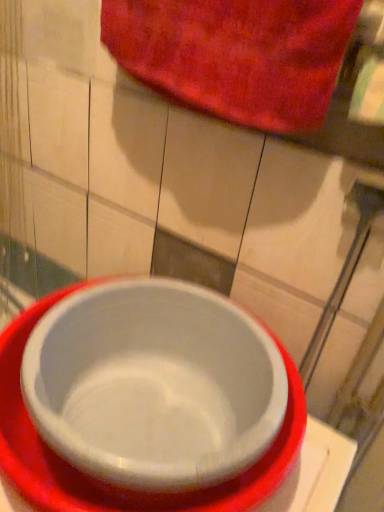
This screenshot has width=384, height=512. What do you see at coordinates (236, 55) in the screenshot?
I see `velvety red towel at upper center` at bounding box center [236, 55].

Find the location of `velvety red towel at upper center`. velvety red towel at upper center is located at coordinates (236, 55).

The width and height of the screenshot is (384, 512). Describe the element at coordinates (154, 385) in the screenshot. I see `white plastic bowl at center` at that location.

Identify the location of white plastic bowl at center. The image size is (384, 512). (154, 385).

Measure the distance between white plastic bowl at center and camera.

white plastic bowl at center is 17.48 inches from camera.

At what (x,y) coordinates should I click in order to perform the action: click on velvety red towel at upper center. Please return your answer as a coordinate pair (x, y). Looking at the image, I should click on (236, 55).

Considering the relative positions of velvety red towel at upper center and white plastic bowl at center in the image provided, is velvety red towel at upper center to the left of white plastic bowl at center from the viewer's perspective?

No.

Does velvety red towel at upper center lie in front of white plastic bowl at center?

No, the depth of velvety red towel at upper center is greater than that of white plastic bowl at center.

Considering the points (273, 23) and (101, 314), which point is in front, point (273, 23) or point (101, 314)?

The point (273, 23) is more forward.

From the image's perspective, which one is positioned lower, velvety red towel at upper center or white plastic bowl at center?

white plastic bowl at center, from the image's perspective.

From a real-world perspective, is velvety red towel at upper center above or below white plastic bowl at center?

Clearly, from a real-world perspective, velvety red towel at upper center is above white plastic bowl at center.

Between velvety red towel at upper center and white plastic bowl at center, which one has smaller width?

velvety red towel at upper center.

Considering the relative sizes of velvety red towel at upper center and white plastic bowl at center in the image provided, is velvety red towel at upper center taller than white plastic bowl at center?

No.

Is velvety red towel at upper center bigger than white plastic bowl at center?

No, velvety red towel at upper center is not bigger than white plastic bowl at center.

Is velvety red towel at upper center not inside white plastic bowl at center?

That's correct, velvety red towel at upper center is outside of white plastic bowl at center.

Is velvety red towel at upper center in contact with white plastic bowl at center?

velvety red towel at upper center is not next to white plastic bowl at center, and they're not touching.

Could you tell me if velvety red towel at upper center is turned towards white plastic bowl at center?

No.

Locate an element on the screen. beach towel above the white plastic bowl at center (from the image's perspective) is located at coordinates (236, 55).

Considering the relative positions of white plastic bowl at center and velvety red towel at upper center in the image provided, is white plastic bowl at center to the left or to the right of velvety red towel at upper center?

white plastic bowl at center is to the left of velvety red towel at upper center.

Considering the relative positions of white plastic bowl at center and velvety red towel at upper center in the image provided, is white plastic bowl at center in front of velvety red towel at upper center?

Yes, the depth of white plastic bowl at center is less than that of velvety red towel at upper center.

Which is nearer, (58, 355) or (225, 92)?

The point (225, 92) is closer to the camera.

From the image's perspective, would you say white plastic bowl at center is shown under velvety red towel at upper center?

Yes, from the image's perspective, white plastic bowl at center is below velvety red towel at upper center.

Looking at this image, from a real-world perspective, which is physically above, white plastic bowl at center or velvety red towel at upper center?

From a 3D spatial view, velvety red towel at upper center is above.

Between white plastic bowl at center and velvety red towel at upper center, which one has smaller width?

velvety red towel at upper center is thinner.

Between white plastic bowl at center and velvety red towel at upper center, which one has less height?

Standing shorter between the two is velvety red towel at upper center.

Based on the photo, can you confirm if white plastic bowl at center is bigger than velvety red towel at upper center?

Indeed, white plastic bowl at center has a larger size compared to velvety red towel at upper center.

Choose the correct answer: Is white plastic bowl at center inside velvety red towel at upper center or outside it?

white plastic bowl at center is outside velvety red towel at upper center.

Is white plastic bowl at center not near velvety red towel at upper center?

Actually, white plastic bowl at center and velvety red towel at upper center are a little close together.

Is white plastic bowl at center oriented towards velvety red towel at upper center?

No, white plastic bowl at center is not oriented towards velvety red towel at upper center.

There is a white plastic bowl at center. At what (x,y) coordinates should I click in order to perform the action: click on beach towel above it (from a real-world perspective). Please return your answer as a coordinate pair (x, y). Looking at the image, I should click on (236, 55).

At what (x,y) coordinates should I click in order to perform the action: click on bowl that is in front of the velvety red towel at upper center. Please return your answer as a coordinate pair (x, y). The width and height of the screenshot is (384, 512). Looking at the image, I should click on (154, 385).

Identify the location of beach towel on the right of white plastic bowl at center. This screenshot has height=512, width=384. (236, 55).